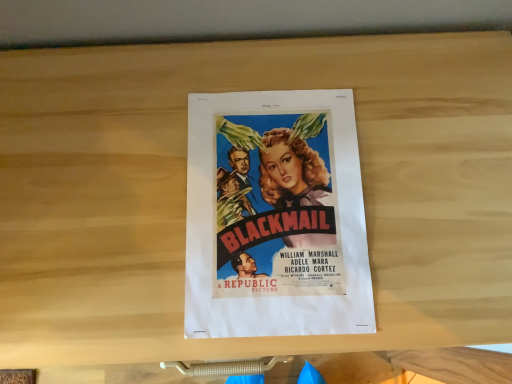
Locate an element on the screen. The width and height of the screenshot is (512, 384). vacant space to the right of matte paper poster at center is located at coordinates (435, 193).